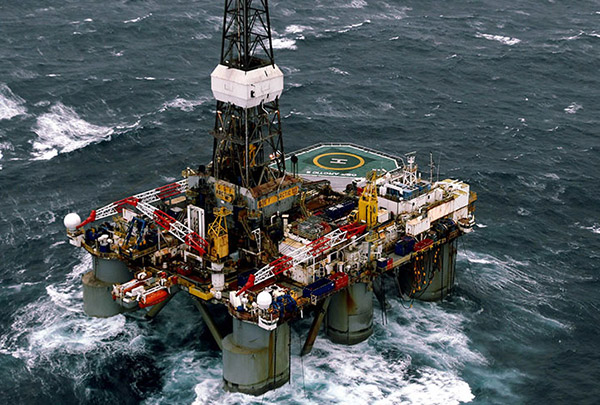
You are a GUI agent. You are given a task and a screenshot of the screen. Output one action in this format:
    pyautogui.click(x=<x>, y=<y>)
    Task: Click on the slanted support beams
    Image resolution: width=600 pixels, height=405 pixels.
    Given the screenshot: What is the action you would take?
    pyautogui.click(x=316, y=315), pyautogui.click(x=208, y=322)